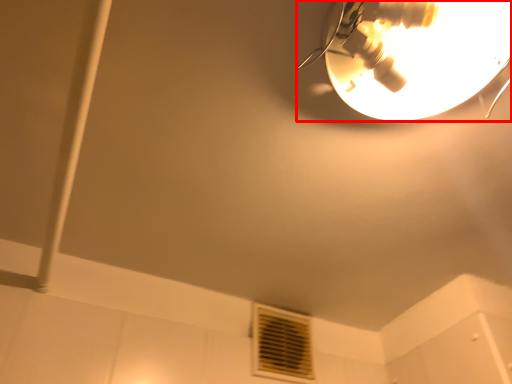
Question: Considering the relative positions of lamp (annotated by the red box) and air conditioning in the image provided, where is lamp (annotated by the red box) located with respect to the staircase?

Choices:
 (A) right
 (B) left

Answer: (A)